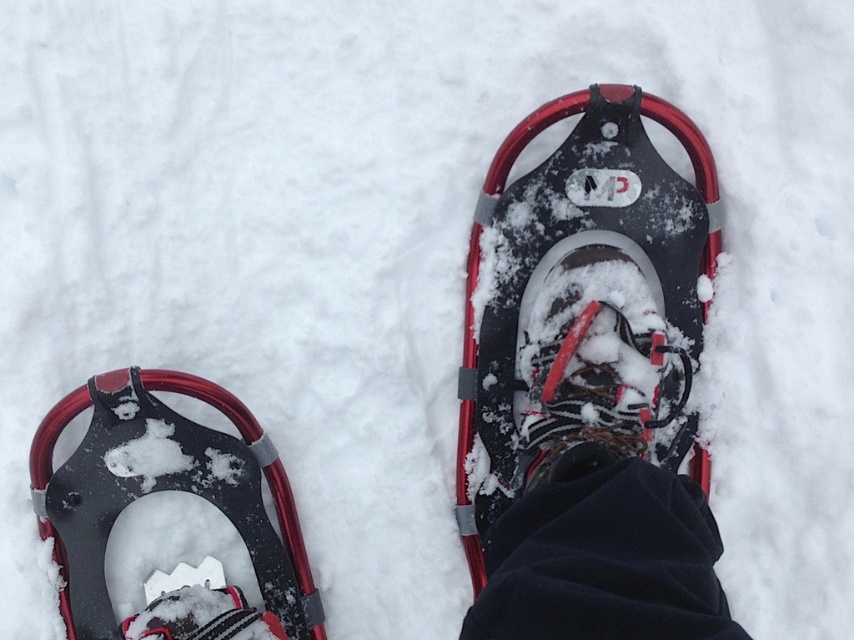
You are planning to buy snowshoes for a winter hike. You need to choose between the black rubber snowshoe at center and the matte black snowshoe at lower left based on their width. Which one would provide better flotation in deep snow?

The matte black snowshoe at lower left has a greater width than the black rubber snowshoe at center, so it would provide better flotation in deep snow.

You are a photographer trying to capture a clear image of the black rubber snowshoe at center. Your camera has a minimum focusing distance of 1.5 meters. Can you take a clear photo without moving closer?

The black rubber snowshoe at center and camera are 1.56 meters apart from each other. Since the minimum focusing distance is 1.5 meters, the camera can focus on the black rubber snowshoe at center as the distance is slightly more than the required minimum.

You are planning to place a small marker on the snow next to the black rubber snowshoe at center. Given the coordinates provided in the Objects Description, where should you place the marker to ensure it is directly to the right of the snowshoe?

The black rubber snowshoe at center is located at point coordinates (581, 264). To place the marker directly to the right, you should position it at a higher x coordinate, such as (581, 328).